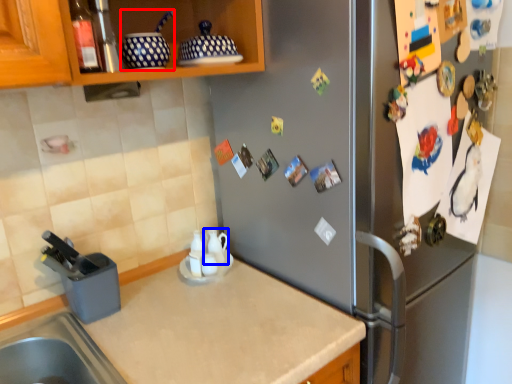
Question: Which object appears farthest to the camera in this image, appliance (highlighted by a red box) or tea pot (highlighted by a blue box)?

Choices:
 (A) appliance
 (B) tea pot

Answer: (B)